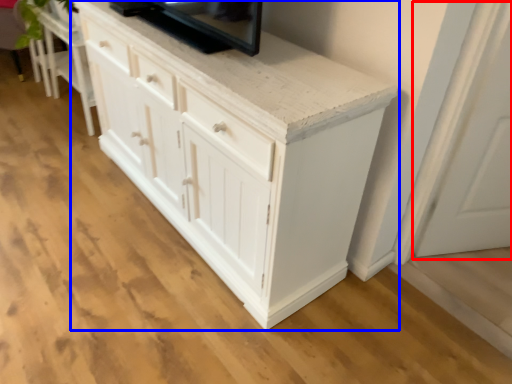
Question: Among these objects, which one is farthest to the camera, glass door (highlighted by a red box) or chest of drawers (highlighted by a blue box)?

Choices:
 (A) glass door
 (B) chest of drawers

Answer: (A)